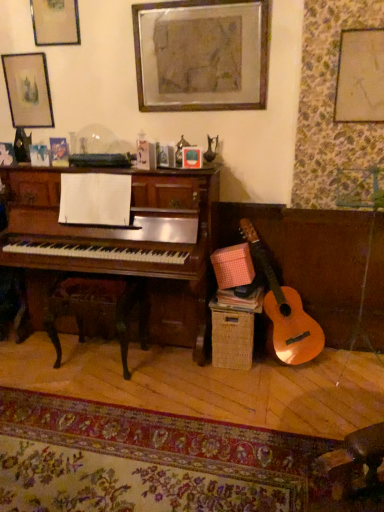
Question: Are wooden picture frame at upper center, which appears as the fourth picture frame when viewed from the left, and wooden rocking chair at lower left beside each other?

Choices:
 (A) no
 (B) yes

Answer: (A)

Question: Does wooden picture frame at upper center, which appears as the fourth picture frame when viewed from the left, lie in front of wooden rocking chair at lower left?

Choices:
 (A) yes
 (B) no

Answer: (A)

Question: From a real-world perspective, is wooden picture frame at upper center, marked as the 2th picture frame in a right-to-left arrangement, positioned over wooden rocking chair at lower left based on gravity?

Choices:
 (A) no
 (B) yes

Answer: (B)

Question: Is wooden picture frame at upper center, which appears as the fourth picture frame when viewed from the left, aimed at wooden rocking chair at lower left?

Choices:
 (A) yes
 (B) no

Answer: (B)

Question: Can you confirm if wooden picture frame at upper center, marked as the 2th picture frame in a right-to-left arrangement, is smaller than wooden rocking chair at lower left?

Choices:
 (A) no
 (B) yes

Answer: (B)

Question: Is wooden rocking chair at lower left surrounded by wooden picture frame at upper center, which appears as the fourth picture frame when viewed from the left?

Choices:
 (A) yes
 (B) no

Answer: (B)

Question: Can you confirm if matte gold picture frame at upper left, the 4th picture frame when ordered from right to left, is shorter than wooden rocking chair at lower left?

Choices:
 (A) no
 (B) yes

Answer: (B)

Question: Does matte gold picture frame at upper left, positioned as the 2th picture frame in left-to-right order, have a lesser width compared to wooden rocking chair at lower left?

Choices:
 (A) yes
 (B) no

Answer: (A)

Question: Is matte gold picture frame at upper left, the 4th picture frame when ordered from right to left, smaller than wooden rocking chair at lower left?

Choices:
 (A) yes
 (B) no

Answer: (A)

Question: Could you tell me if matte gold picture frame at upper left, the 4th picture frame when ordered from right to left, is turned towards wooden rocking chair at lower left?

Choices:
 (A) no
 (B) yes

Answer: (A)

Question: Is matte gold picture frame at upper left, positioned as the 2th picture frame in left-to-right order, to the right of wooden rocking chair at lower left from the viewer's perspective?

Choices:
 (A) no
 (B) yes

Answer: (A)

Question: Is matte gold picture frame at upper left, positioned as the 2th picture frame in left-to-right order, at the left side of wooden rocking chair at lower left?

Choices:
 (A) no
 (B) yes

Answer: (B)

Question: Does matte glass picture frame at upper center, which appears as the 3th picture frame when viewed from the left, have a greater height compared to matte gold picture frame at upper left, positioned as the 2th picture frame in left-to-right order?

Choices:
 (A) yes
 (B) no

Answer: (B)